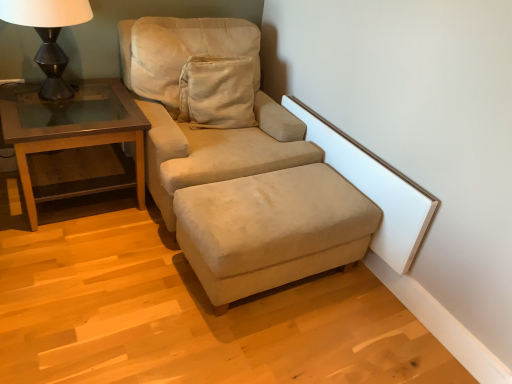
Question: From their relative heights in the image, would you say beige suede ottoman at lower center is taller or shorter than suede beige studio couch at center?

Choices:
 (A) short
 (B) tall

Answer: (A)

Question: Considering the positions of beige suede ottoman at lower center and suede beige studio couch at center in the image, is beige suede ottoman at lower center bigger or smaller than suede beige studio couch at center?

Choices:
 (A) small
 (B) big

Answer: (A)

Question: Estimate the real-world distances between objects in this image. Which object is closer to the brown wood/glass table at left?

Choices:
 (A) suede beige studio couch at center
 (B) beige suede ottoman at lower center
 (C) matte black lamp at left

Answer: (C)

Question: Based on their relative distances, which object is farther from the suede beige studio couch at center?

Choices:
 (A) brown wood/glass table at left
 (B) matte black lamp at left
 (C) beige suede ottoman at lower center

Answer: (B)